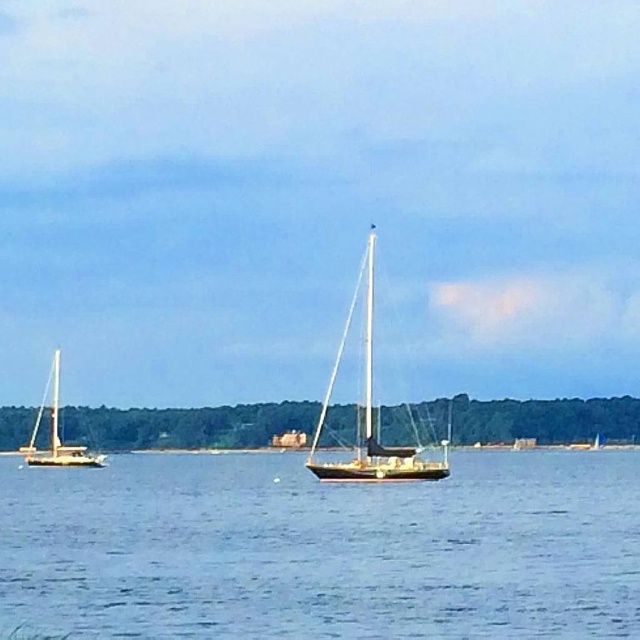
Question: Observing the image, what is the correct spatial positioning of clear blue water at center in reference to wooden sailboat at left?

Choices:
 (A) left
 (B) right

Answer: (B)

Question: Estimate the real-world distances between objects in this image. Which object is farther from the clear blue water at center?

Choices:
 (A) wooden sailboat at left
 (B) wooden sailboat at center

Answer: (A)

Question: Which of the following is the closest to the observer?

Choices:
 (A) clear blue water at center
 (B) wooden sailboat at left
 (C) wooden sailboat at center

Answer: (A)

Question: Is clear blue water at center wider than wooden sailboat at left?

Choices:
 (A) no
 (B) yes

Answer: (B)

Question: Does clear blue water at center have a greater width compared to wooden sailboat at left?

Choices:
 (A) yes
 (B) no

Answer: (A)

Question: Among these objects, which one is farthest from the camera?

Choices:
 (A) clear blue water at center
 (B) wooden sailboat at center

Answer: (B)